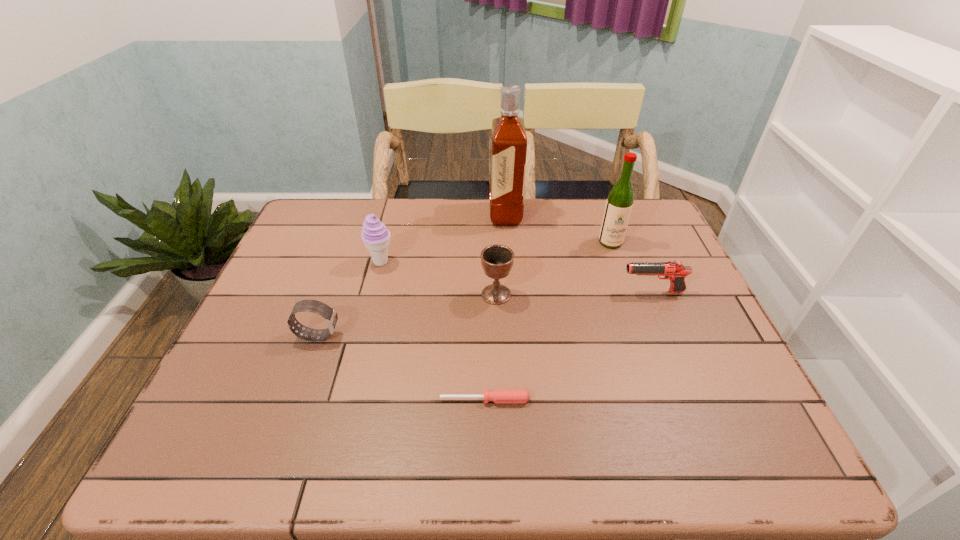
Image resolution: width=960 pixels, height=540 pixels. I want to click on the farthest object, so click(509, 141).

The image size is (960, 540). Find the location of `the taller liquor`. the taller liquor is located at coordinates (509, 141).

Where is `the nearer liquor`? the nearer liquor is located at coordinates (619, 203).

You are a GUI agent. You are given a task and a screenshot of the screen. Output one action in this format:
    pyautogui.click(x=<x>, y=<y>)
    Task: Click on the right liquor
    This screenshot has width=960, height=540.
    Given the screenshot: What is the action you would take?
    pyautogui.click(x=619, y=203)

Where is `icecream`? icecream is located at coordinates (375, 236).

Where is `the fifth nearest object`? Image resolution: width=960 pixels, height=540 pixels. the fifth nearest object is located at coordinates (375, 236).

This screenshot has width=960, height=540. Identify the location of chalice. (497, 260).

Identify the location of the leftmost object. (314, 306).

Where is `watch`? watch is located at coordinates (314, 306).

This screenshot has width=960, height=540. What are the coordinates of `gun` in the screenshot? It's located at (674, 270).